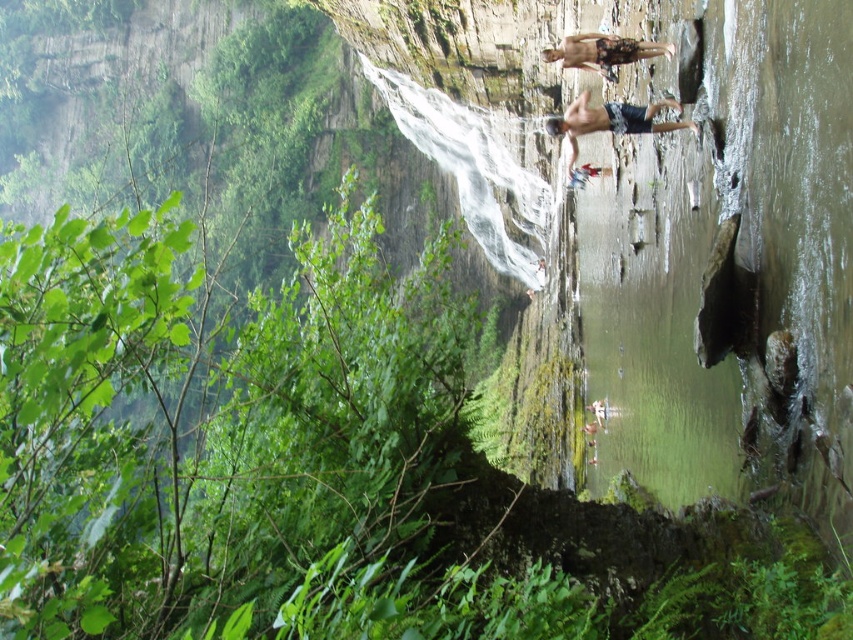
Measure the distance between smooth skin rock climber at upper right and camouflage shorts at upper center.

4.14 meters

Between smooth skin rock climber at upper right and camouflage shorts at upper center, which one appears on the left side from the viewer's perspective?

camouflage shorts at upper center is more to the left.

Measure the distance between smooth skin rock climber at upper right and camera.

They are 47.83 meters apart.

I want to click on smooth skin rock climber at upper right, so click(611, 120).